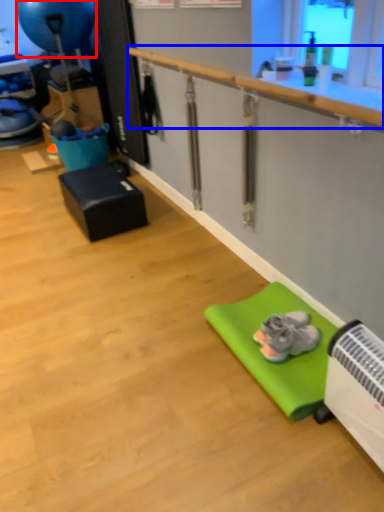
Question: Which of the following is the farthest to the observer, balloon (highlighted by a red box) or rail (highlighted by a blue box)?

Choices:
 (A) balloon
 (B) rail

Answer: (A)